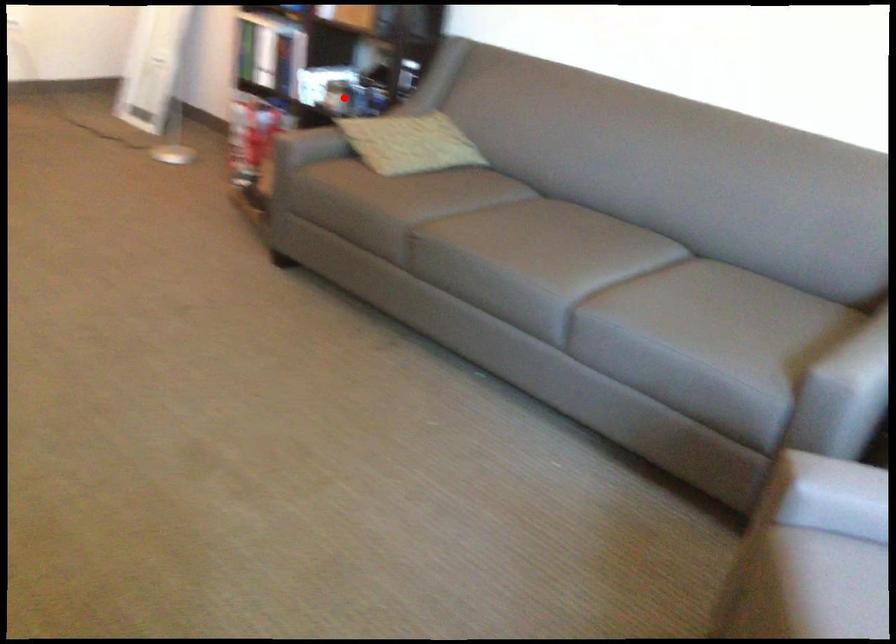
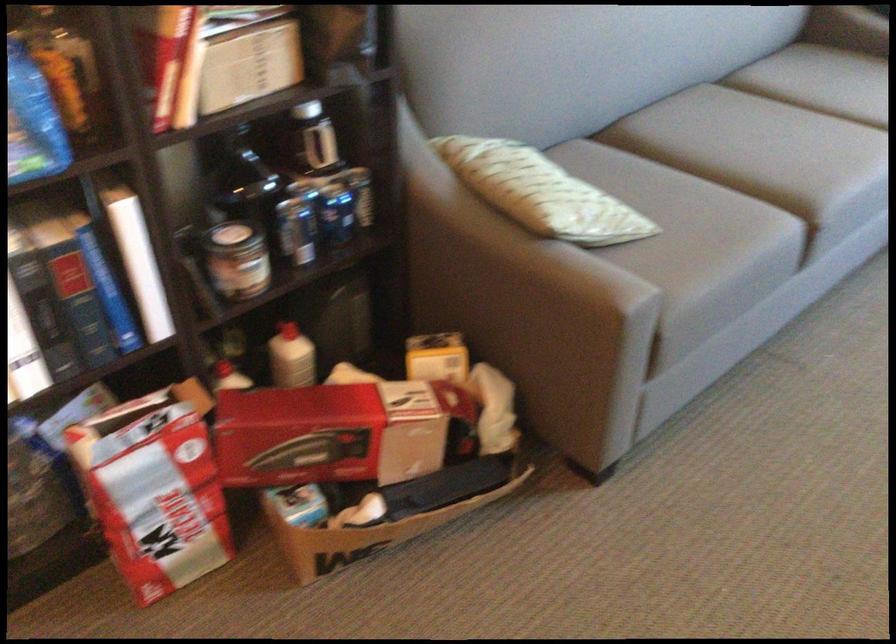
Question: I am providing you with two images of the same scene from different viewpoints. Image1 has a red point marked. In image2, the corresponding 3D location appears at what relative position? Reply with the corresponding letter.

Choices:
 (A) Closer
 (B) Farther

Answer: (A)